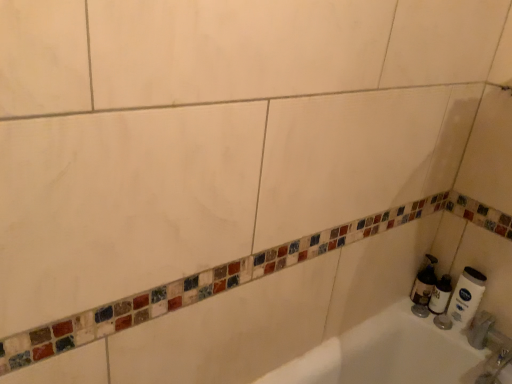
Question: From a real-world perspective, does translucent plastic soap dispenser at lower right sit lower than white matte tube at right, which appears as the 1th toilet paper when viewed from the right?

Choices:
 (A) yes
 (B) no

Answer: (A)

Question: Does translucent plastic soap dispenser at lower right have a lesser height compared to white matte tube at right, which is the second toilet paper in left-to-right order?

Choices:
 (A) no
 (B) yes

Answer: (B)

Question: From the image's perspective, is translucent plastic soap dispenser at lower right above white matte tube at right, which is the second toilet paper in left-to-right order?

Choices:
 (A) yes
 (B) no

Answer: (A)

Question: Does translucent plastic soap dispenser at lower right have a greater height compared to white matte tube at right, which appears as the 1th toilet paper when viewed from the right?

Choices:
 (A) yes
 (B) no

Answer: (B)

Question: Is translucent plastic soap dispenser at lower right outside white matte tube at right, which appears as the 1th toilet paper when viewed from the right?

Choices:
 (A) yes
 (B) no

Answer: (A)

Question: Considering the positions of white matte toilet paper at right, which is the second toilet paper from right to left, and white matte tube at right, which is the second toilet paper in left-to-right order, in the image, is white matte toilet paper at right, which is the second toilet paper from right to left, taller or shorter than white matte tube at right, which is the second toilet paper in left-to-right order,?

Choices:
 (A) tall
 (B) short

Answer: (B)

Question: Based on their sizes in the image, would you say white matte toilet paper at right, which ranks as the first toilet paper in left-to-right order, is bigger or smaller than white matte tube at right, which appears as the 1th toilet paper when viewed from the right?

Choices:
 (A) big
 (B) small

Answer: (B)

Question: From a real-world perspective, is white matte toilet paper at right, which ranks as the first toilet paper in left-to-right order, above or below white matte tube at right, which is the second toilet paper in left-to-right order?

Choices:
 (A) above
 (B) below

Answer: (B)

Question: Is white matte toilet paper at right, which is the second toilet paper from right to left, wider or thinner than white matte tube at right, which appears as the 1th toilet paper when viewed from the right?

Choices:
 (A) thin
 (B) wide

Answer: (B)

Question: In terms of height, does white matte toilet paper at right, which is the second toilet paper from right to left, look taller or shorter compared to translucent plastic soap dispenser at lower right?

Choices:
 (A) short
 (B) tall

Answer: (A)

Question: From a real-world perspective, relative to translucent plastic soap dispenser at lower right, is white matte toilet paper at right, which ranks as the first toilet paper in left-to-right order, vertically above or below?

Choices:
 (A) above
 (B) below

Answer: (B)

Question: Visually, is white matte toilet paper at right, which is the second toilet paper from right to left, positioned to the left or to the right of translucent plastic soap dispenser at lower right?

Choices:
 (A) right
 (B) left

Answer: (A)

Question: From the image's perspective, is white matte toilet paper at right, which ranks as the first toilet paper in left-to-right order, positioned above or below translucent plastic soap dispenser at lower right?

Choices:
 (A) below
 (B) above

Answer: (A)

Question: In the image, is white matte tube at right, which is the second toilet paper in left-to-right order, on the left side or the right side of translucent plastic soap dispenser at lower right?

Choices:
 (A) left
 (B) right

Answer: (B)

Question: Does point (477, 276) appear closer or farther from the camera than point (415, 288)?

Choices:
 (A) closer
 (B) farther

Answer: (A)